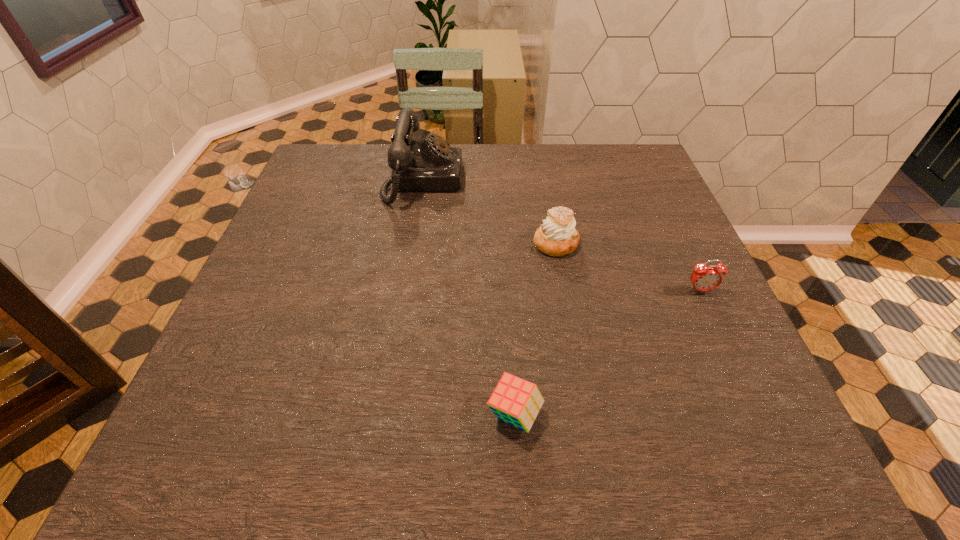
The image size is (960, 540). I want to click on free space that satisfies the following two spatial constraints: 1. on the dial of the tallest object; 2. on the right side of the cube, so click(386, 415).

Image resolution: width=960 pixels, height=540 pixels. What are the coordinates of `vacant region that satisfies the following two spatial constraints: 1. on the dial of the telephone; 2. on the left side of the second farthest object` in the screenshot? It's located at (413, 244).

Find the location of a particular element. Image resolution: width=960 pixels, height=540 pixels. vacant space that satisfies the following two spatial constraints: 1. on the dial of the farthest object; 2. on the right side of the second object from right to left is located at coordinates (413, 244).

Image resolution: width=960 pixels, height=540 pixels. What are the coordinates of `blank space that satisfies the following two spatial constraints: 1. on the dial of the telephone; 2. on the back side of the pastry` in the screenshot? It's located at coord(413,244).

Where is `free space that satisfies the following two spatial constraints: 1. on the dial of the leftmost object; 2. on the left side of the second object from right to left`? free space that satisfies the following two spatial constraints: 1. on the dial of the leftmost object; 2. on the left side of the second object from right to left is located at coordinates (413, 244).

Where is `vacant region that satisfies the following two spatial constraints: 1. on the back side of the pastry; 2. on the dial of the leftmost object`? The width and height of the screenshot is (960, 540). vacant region that satisfies the following two spatial constraints: 1. on the back side of the pastry; 2. on the dial of the leftmost object is located at coordinates (544, 180).

Where is `vacant space that satisfies the following two spatial constraints: 1. on the dial of the cube; 2. on the left side of the leftmost object`? This screenshot has width=960, height=540. vacant space that satisfies the following two spatial constraints: 1. on the dial of the cube; 2. on the left side of the leftmost object is located at coordinates (386, 415).

The width and height of the screenshot is (960, 540). I want to click on vacant space that satisfies the following two spatial constraints: 1. on the back side of the cube; 2. on the dial of the telephone, so click(501, 180).

Image resolution: width=960 pixels, height=540 pixels. Identify the location of free location that satisfies the following two spatial constraints: 1. on the dial of the third object from right to left; 2. on the right side of the telephone. (386, 415).